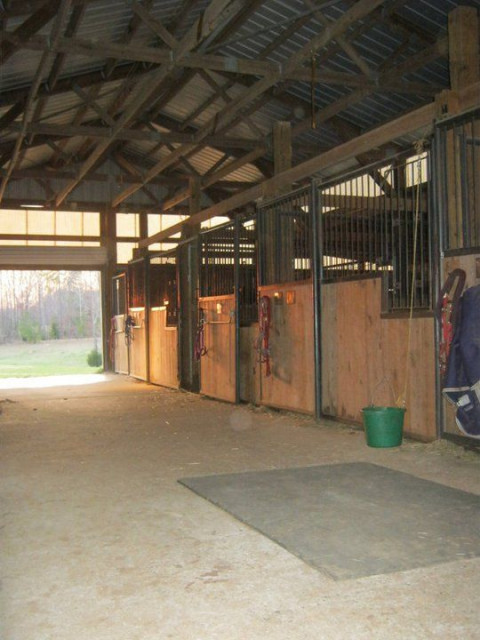
The height and width of the screenshot is (640, 480). In order to click on green bucket in this screenshot , I will do `click(385, 426)`.